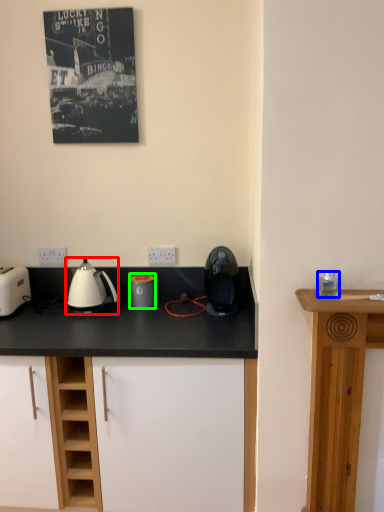
Question: Which is farther away from kettle (highlighted by a red box)? appliance (highlighted by a blue box) or kitchen appliance (highlighted by a green box)?

Choices:
 (A) appliance
 (B) kitchen appliance

Answer: (A)